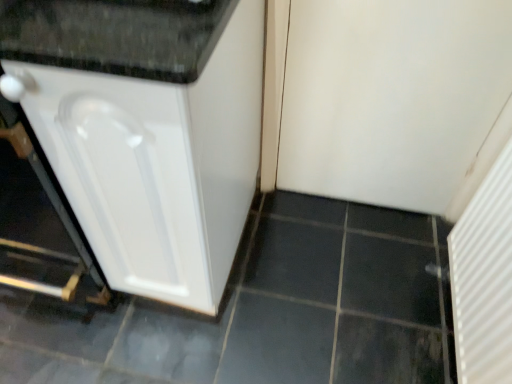
Where is `white glossy cabinet at left`? The width and height of the screenshot is (512, 384). white glossy cabinet at left is located at coordinates (146, 130).

Image resolution: width=512 pixels, height=384 pixels. What do you see at coordinates (395, 100) in the screenshot?
I see `white matte door at upper right, arranged as the 2th screen door when ordered from the bottom` at bounding box center [395, 100].

Find the location of `white glossy cabinet at left`. white glossy cabinet at left is located at coordinates (146, 130).

Considering the sizes of objects white glossy cabinet at left and white textured radiator at right, the 2th screen door in the top-to-bottom sequence, in the image provided, who is thinner, white glossy cabinet at left or white textured radiator at right, the 2th screen door in the top-to-bottom sequence,?

white textured radiator at right, the 2th screen door in the top-to-bottom sequence.

The height and width of the screenshot is (384, 512). In order to click on cabinetry lying in front of the white textured radiator at right, the 1th screen door positioned from the bottom in this screenshot , I will do `click(146, 130)`.

Based on the photo, considering the sizes of objects white glossy cabinet at left and white textured radiator at right, the 1th screen door positioned from the bottom, in the image provided, who is bigger, white glossy cabinet at left or white textured radiator at right, the 1th screen door positioned from the bottom,?

Bigger between the two is white glossy cabinet at left.

From the picture: Between white glossy cabinet at left and white matte door at upper right, the first screen door positioned from the top, which one has larger width?

With larger width is white glossy cabinet at left.

The width and height of the screenshot is (512, 384). In order to click on cabinetry that is above the white matte door at upper right, arranged as the 2th screen door when ordered from the bottom (from a real-world perspective) in this screenshot , I will do `click(146, 130)`.

Is white glossy cabinet at left far from white matte door at upper right, arranged as the 2th screen door when ordered from the bottom?

No, white glossy cabinet at left is not far away from white matte door at upper right, arranged as the 2th screen door when ordered from the bottom.

From a real-world perspective, is white glossy cabinet at left under white matte door at upper right, the first screen door positioned from the top?

No, from a real-world perspective, white glossy cabinet at left is not under white matte door at upper right, the first screen door positioned from the top.

Is there a large distance between white textured radiator at right, the 2th screen door in the top-to-bottom sequence, and white matte door at upper right, arranged as the 2th screen door when ordered from the bottom?

Actually, white textured radiator at right, the 2th screen door in the top-to-bottom sequence, and white matte door at upper right, arranged as the 2th screen door when ordered from the bottom, are a little close together.

Is white textured radiator at right, the 2th screen door in the top-to-bottom sequence, situated inside white matte door at upper right, arranged as the 2th screen door when ordered from the bottom, or outside?

white textured radiator at right, the 2th screen door in the top-to-bottom sequence, is not inside white matte door at upper right, arranged as the 2th screen door when ordered from the bottom, it's outside.

In the image, is white textured radiator at right, the 1th screen door positioned from the bottom, positioned in front of or behind white matte door at upper right, the first screen door positioned from the top?

In the image, white textured radiator at right, the 1th screen door positioned from the bottom, appears in front of white matte door at upper right, the first screen door positioned from the top.

The height and width of the screenshot is (384, 512). I want to click on screen door that is above the white textured radiator at right, the 2th screen door in the top-to-bottom sequence (from the image's perspective), so click(x=395, y=100).

Does white matte door at upper right, arranged as the 2th screen door when ordered from the bottom, appear on the right side of white textured radiator at right, the 1th screen door positioned from the bottom?

In fact, white matte door at upper right, arranged as the 2th screen door when ordered from the bottom, is to the left of white textured radiator at right, the 1th screen door positioned from the bottom.

Is white matte door at upper right, arranged as the 2th screen door when ordered from the bottom, directly adjacent to white textured radiator at right, the 2th screen door in the top-to-bottom sequence?

No, white matte door at upper right, arranged as the 2th screen door when ordered from the bottom, is not in contact with white textured radiator at right, the 2th screen door in the top-to-bottom sequence.

Is white matte door at upper right, arranged as the 2th screen door when ordered from the bottom, further to camera compared to white textured radiator at right, the 1th screen door positioned from the bottom?

Yes, white matte door at upper right, arranged as the 2th screen door when ordered from the bottom, is behind white textured radiator at right, the 1th screen door positioned from the bottom.

Where is `the 2nd screen door behind the white glossy cabinet at left, counting from the anchor's position`? Image resolution: width=512 pixels, height=384 pixels. the 2nd screen door behind the white glossy cabinet at left, counting from the anchor's position is located at coordinates (395, 100).

How different are the orientations of white matte door at upper right, the first screen door positioned from the top, and white glossy cabinet at left in degrees?

The angular difference between white matte door at upper right, the first screen door positioned from the top, and white glossy cabinet at left is 0.371 degrees.

Does white matte door at upper right, arranged as the 2th screen door when ordered from the bottom, appear on the right side of white glossy cabinet at left?

Yes.

Is point (501, 274) closer or farther from the camera than point (164, 159)?

Point (501, 274) is positioned farther from the camera compared to point (164, 159).

In order to click on cabinetry above the white textured radiator at right, the 1th screen door positioned from the bottom (from the image's perspective) in this screenshot , I will do `click(146, 130)`.

Is white glossy cabinet at left located within white textured radiator at right, the 1th screen door positioned from the bottom?

Actually, white glossy cabinet at left is outside white textured radiator at right, the 1th screen door positioned from the bottom.

Does white textured radiator at right, the 1th screen door positioned from the bottom, turn towards white glossy cabinet at left?

Yes, white textured radiator at right, the 1th screen door positioned from the bottom, is facing white glossy cabinet at left.

Locate an element on the screen. The height and width of the screenshot is (384, 512). screen door that is the 2nd one below the white glossy cabinet at left (from a real-world perspective) is located at coordinates (484, 279).

Find the location of a particular element. cabinetry on the left of white matte door at upper right, arranged as the 2th screen door when ordered from the bottom is located at coordinates (146, 130).

When comparing their distances from white glossy cabinet at left, does white matte door at upper right, arranged as the 2th screen door when ordered from the bottom, or white textured radiator at right, the 2th screen door in the top-to-bottom sequence, seem further?

white textured radiator at right, the 2th screen door in the top-to-bottom sequence, is positioned further to the anchor white glossy cabinet at left.

Looking at the image, which one is located further to white textured radiator at right, the 2th screen door in the top-to-bottom sequence, white glossy cabinet at left or white matte door at upper right, arranged as the 2th screen door when ordered from the bottom?

white glossy cabinet at left lies further to white textured radiator at right, the 2th screen door in the top-to-bottom sequence, than the other object.

Estimate the real-world distances between objects in this image. Which object is further from white textured radiator at right, the 2th screen door in the top-to-bottom sequence, white matte door at upper right, the first screen door positioned from the top, or white glossy cabinet at left?

white glossy cabinet at left is positioned further to the anchor white textured radiator at right, the 2th screen door in the top-to-bottom sequence.

Looking at the image, which one is located closer to white matte door at upper right, arranged as the 2th screen door when ordered from the bottom, white textured radiator at right, the 1th screen door positioned from the bottom, or white glossy cabinet at left?

white textured radiator at right, the 1th screen door positioned from the bottom, is positioned closer to the anchor white matte door at upper right, arranged as the 2th screen door when ordered from the bottom.

When comparing their distances from white matte door at upper right, arranged as the 2th screen door when ordered from the bottom, does white glossy cabinet at left or white textured radiator at right, the 2th screen door in the top-to-bottom sequence, seem further?

white glossy cabinet at left is further to white matte door at upper right, arranged as the 2th screen door when ordered from the bottom.

Considering their positions, is white textured radiator at right, the 2th screen door in the top-to-bottom sequence, positioned closer to white glossy cabinet at left than white matte door at upper right, arranged as the 2th screen door when ordered from the bottom?

The object closer to white glossy cabinet at left is white matte door at upper right, arranged as the 2th screen door when ordered from the bottom.

Where is `screen door between white glossy cabinet at left and white textured radiator at right, the 1th screen door positioned from the bottom`? The width and height of the screenshot is (512, 384). screen door between white glossy cabinet at left and white textured radiator at right, the 1th screen door positioned from the bottom is located at coordinates (395, 100).